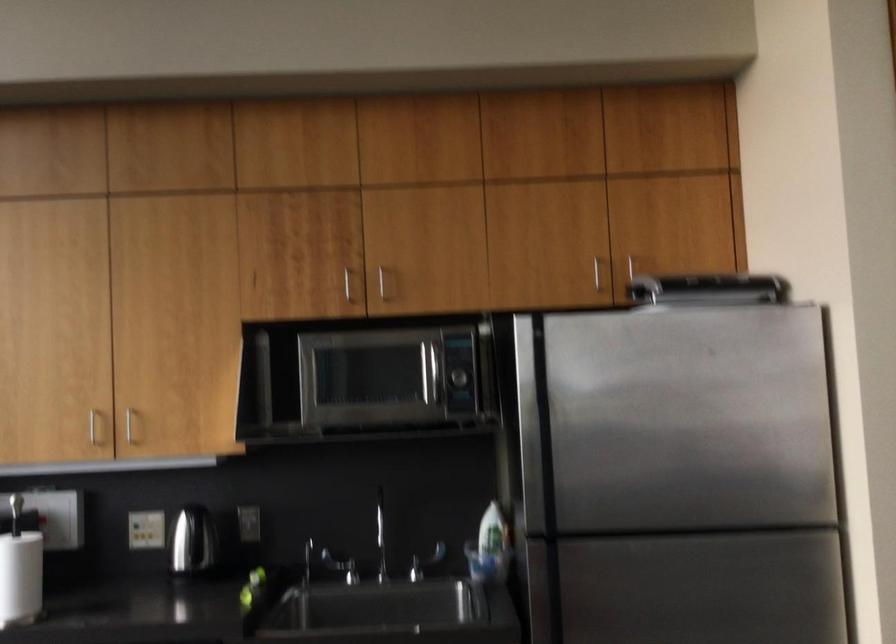
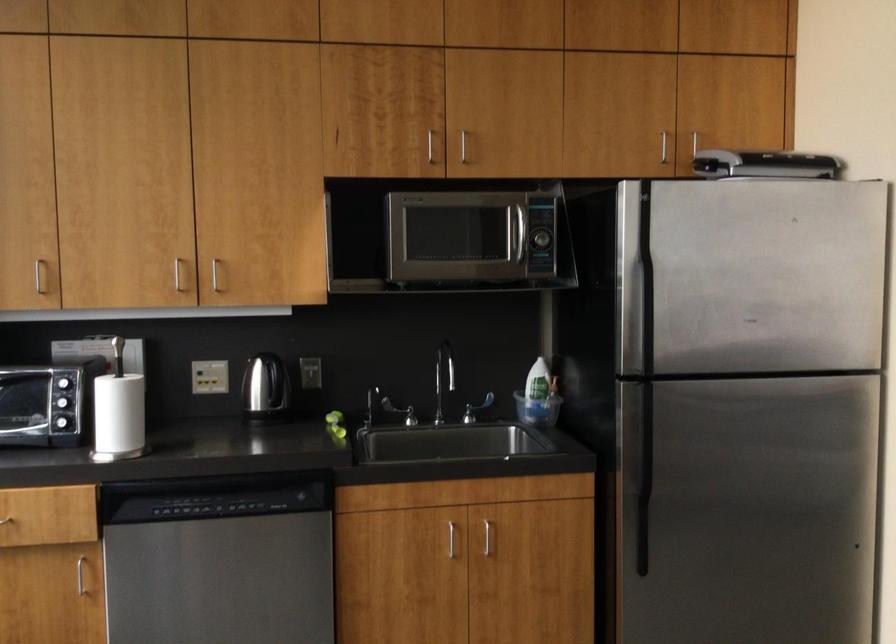
In the second image, find the point that corresponds to the point at 541,404 in the first image.

(636, 267)